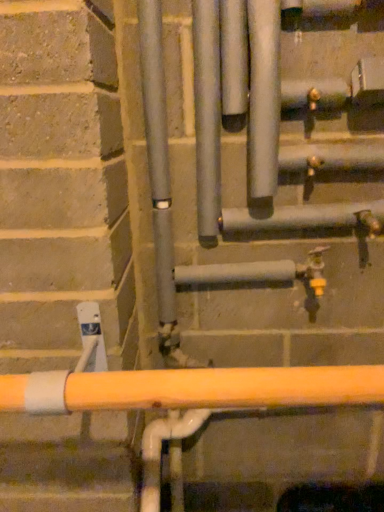
Where is `satin silver pipes at center, which is the second pipe in right-to-left order`? The image size is (384, 512). satin silver pipes at center, which is the second pipe in right-to-left order is located at coordinates (207, 116).

The width and height of the screenshot is (384, 512). Describe the element at coordinates (207, 116) in the screenshot. I see `satin silver pipes at center, which is the 1th pipe in left-to-right order` at that location.

The image size is (384, 512). Describe the element at coordinates (263, 98) in the screenshot. I see `satin silver pipe at upper center, which is the 2th pipe in left-to-right order` at that location.

The image size is (384, 512). What are the coordinates of `satin silver pipe at upper center, which is the first pipe from right to left` in the screenshot? It's located at (263, 98).

At what (x,y) coordinates should I click in order to perform the action: click on satin silver pipes at center, which is the 1th pipe in left-to-right order. Please return your answer as a coordinate pair (x, y). This screenshot has width=384, height=512. Looking at the image, I should click on (207, 116).

Which is more to the left, satin silver pipes at center, which is the 1th pipe in left-to-right order, or satin silver pipe at upper center, which is the first pipe from right to left?

Positioned to the left is satin silver pipes at center, which is the 1th pipe in left-to-right order.

Looking at this image, in the image, is satin silver pipes at center, which is the second pipe in right-to-left order, positioned in front of or behind satin silver pipe at upper center, which is the first pipe from right to left?

satin silver pipes at center, which is the second pipe in right-to-left order, is behind satin silver pipe at upper center, which is the first pipe from right to left.

Considering the positions of point (200, 72) and point (269, 44), is point (200, 72) closer or farther from the camera than point (269, 44)?

Point (200, 72) is farther from the camera than point (269, 44).

From the image's perspective, between satin silver pipes at center, which is the 1th pipe in left-to-right order, and satin silver pipe at upper center, which is the first pipe from right to left, who is located below?

satin silver pipes at center, which is the 1th pipe in left-to-right order, from the image's perspective.

From a real-world perspective, which object stands above the other?

From a 3D spatial view, satin silver pipe at upper center, which is the first pipe from right to left, is above.

Based on the photo, considering the sizes of objects satin silver pipes at center, which is the 1th pipe in left-to-right order, and satin silver pipe at upper center, which is the 2th pipe in left-to-right order, in the image provided, who is thinner, satin silver pipes at center, which is the 1th pipe in left-to-right order, or satin silver pipe at upper center, which is the 2th pipe in left-to-right order,?

Thinner between the two is satin silver pipes at center, which is the 1th pipe in left-to-right order.

Does satin silver pipes at center, which is the 1th pipe in left-to-right order, have a greater height compared to satin silver pipe at upper center, which is the first pipe from right to left?

Incorrect, the height of satin silver pipes at center, which is the 1th pipe in left-to-right order, is not larger of that of satin silver pipe at upper center, which is the first pipe from right to left.

Is satin silver pipes at center, which is the 1th pipe in left-to-right order, bigger than satin silver pipe at upper center, which is the 2th pipe in left-to-right order?

Actually, satin silver pipes at center, which is the 1th pipe in left-to-right order, might be smaller than satin silver pipe at upper center, which is the 2th pipe in left-to-right order.

Is satin silver pipes at center, which is the 1th pipe in left-to-right order, spatially inside satin silver pipe at upper center, which is the first pipe from right to left, or outside of it?

satin silver pipes at center, which is the 1th pipe in left-to-right order, is not inside satin silver pipe at upper center, which is the first pipe from right to left, it's outside.

Is satin silver pipes at center, which is the 1th pipe in left-to-right order, with satin silver pipe at upper center, which is the first pipe from right to left?

Yes, satin silver pipes at center, which is the 1th pipe in left-to-right order, is with satin silver pipe at upper center, which is the first pipe from right to left.

Is satin silver pipes at center, which is the second pipe in right-to-left order, oriented towards satin silver pipe at upper center, which is the first pipe from right to left?

No, satin silver pipes at center, which is the second pipe in right-to-left order, is not aimed at satin silver pipe at upper center, which is the first pipe from right to left.

What's the angular difference between satin silver pipes at center, which is the 1th pipe in left-to-right order, and satin silver pipe at upper center, which is the 2th pipe in left-to-right order,'s facing directions?

satin silver pipes at center, which is the 1th pipe in left-to-right order, and satin silver pipe at upper center, which is the 2th pipe in left-to-right order, are facing 0.242 degrees away from each other.

Measure the distance between satin silver pipes at center, which is the second pipe in right-to-left order, and satin silver pipe at upper center, which is the first pipe from right to left.

satin silver pipes at center, which is the second pipe in right-to-left order, and satin silver pipe at upper center, which is the first pipe from right to left, are 3.80 inches apart from each other.

Locate an element on the screen. The height and width of the screenshot is (512, 384). pipe lying above the satin silver pipes at center, which is the 1th pipe in left-to-right order (from the image's perspective) is located at coordinates (263, 98).

Based on their positions, is satin silver pipe at upper center, which is the first pipe from right to left, located to the left or right of satin silver pipes at center, which is the 1th pipe in left-to-right order?

satin silver pipe at upper center, which is the first pipe from right to left, is positioned on satin silver pipes at center, which is the 1th pipe in left-to-right order,'s right side.

Is the position of satin silver pipe at upper center, which is the first pipe from right to left, more distant than that of satin silver pipes at center, which is the 1th pipe in left-to-right order?

No, it is in front of satin silver pipes at center, which is the 1th pipe in left-to-right order.

Does point (263, 131) come behind point (195, 13)?

No, (263, 131) is in front of (195, 13).

From the image's perspective, is satin silver pipe at upper center, which is the first pipe from right to left, located above satin silver pipes at center, which is the 1th pipe in left-to-right order?

Yes, from the image's perspective, satin silver pipe at upper center, which is the first pipe from right to left, is on top of satin silver pipes at center, which is the 1th pipe in left-to-right order.

From a real-world perspective, relative to satin silver pipes at center, which is the 1th pipe in left-to-right order, is satin silver pipe at upper center, which is the 2th pipe in left-to-right order, vertically above or below?

From a real-world perspective, satin silver pipe at upper center, which is the 2th pipe in left-to-right order, is physically above satin silver pipes at center, which is the 1th pipe in left-to-right order.

Looking at their sizes, would you say satin silver pipe at upper center, which is the 2th pipe in left-to-right order, is wider or thinner than satin silver pipes at center, which is the 1th pipe in left-to-right order?

In the image, satin silver pipe at upper center, which is the 2th pipe in left-to-right order, appears to be wider than satin silver pipes at center, which is the 1th pipe in left-to-right order.

Is satin silver pipe at upper center, which is the 2th pipe in left-to-right order, shorter than satin silver pipes at center, which is the 1th pipe in left-to-right order?

Incorrect, the height of satin silver pipe at upper center, which is the 2th pipe in left-to-right order, does not fall short of that of satin silver pipes at center, which is the 1th pipe in left-to-right order.

Does satin silver pipe at upper center, which is the 2th pipe in left-to-right order, have a smaller size compared to satin silver pipes at center, which is the second pipe in right-to-left order?

Actually, satin silver pipe at upper center, which is the 2th pipe in left-to-right order, might be larger than satin silver pipes at center, which is the second pipe in right-to-left order.

Is satin silver pipe at upper center, which is the first pipe from right to left, positioned beyond the bounds of satin silver pipes at center, which is the second pipe in right-to-left order?

Yes, satin silver pipe at upper center, which is the first pipe from right to left, is located beyond the bounds of satin silver pipes at center, which is the second pipe in right-to-left order.

Is satin silver pipe at upper center, which is the first pipe from right to left, far from satin silver pipes at center, which is the second pipe in right-to-left order?

No, satin silver pipe at upper center, which is the first pipe from right to left, is in close proximity to satin silver pipes at center, which is the second pipe in right-to-left order.

Is satin silver pipe at upper center, which is the first pipe from right to left, looking in the opposite direction of satin silver pipes at center, which is the second pipe in right-to-left order?

satin silver pipe at upper center, which is the first pipe from right to left, is not turned away from satin silver pipes at center, which is the second pipe in right-to-left order.

In the scene shown: How many degrees apart are the facing directions of satin silver pipe at upper center, which is the first pipe from right to left, and satin silver pipes at center, which is the second pipe in right-to-left order?

The angular difference between satin silver pipe at upper center, which is the first pipe from right to left, and satin silver pipes at center, which is the second pipe in right-to-left order, is 0.242 degrees.

Where is `pipe lying below the satin silver pipe at upper center, which is the first pipe from right to left (from the image's perspective)`? pipe lying below the satin silver pipe at upper center, which is the first pipe from right to left (from the image's perspective) is located at coordinates (207, 116).

This screenshot has height=512, width=384. I want to click on pipe that is under the satin silver pipe at upper center, which is the 2th pipe in left-to-right order (from a real-world perspective), so click(207, 116).

The image size is (384, 512). I want to click on pipe that appears on the right of satin silver pipes at center, which is the second pipe in right-to-left order, so click(263, 98).